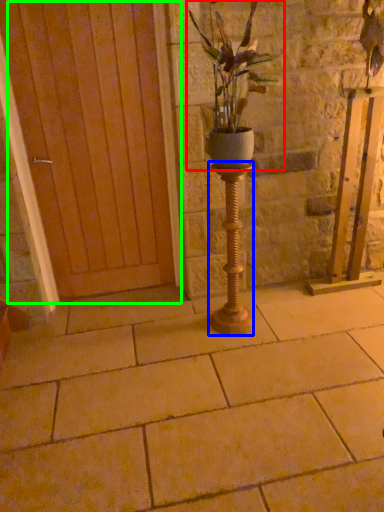
Question: Which object is the closest to the houseplant (highlighted by a red box)? Choose among these: candle holder (highlighted by a blue box) or door (highlighted by a green box).

Choices:
 (A) candle holder
 (B) door

Answer: (A)